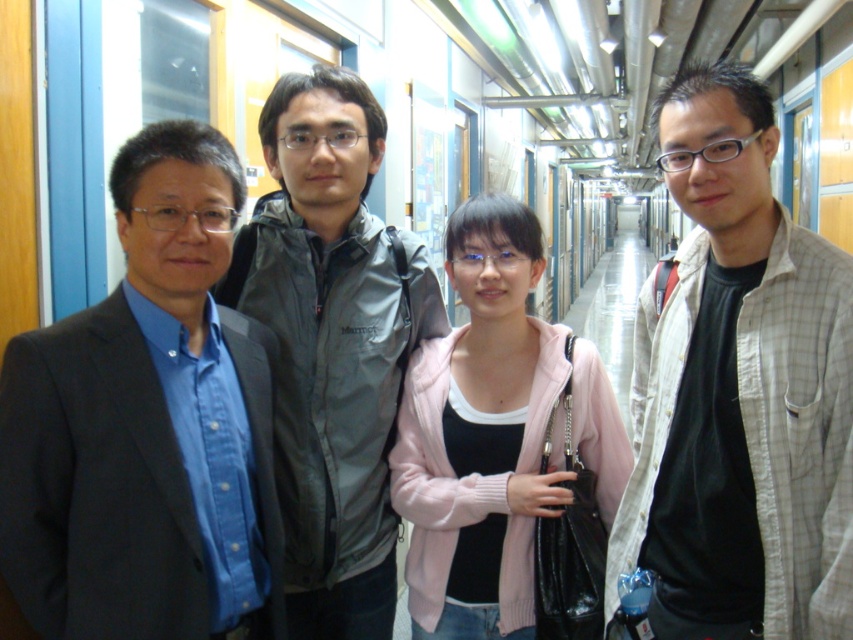
Is white checkered shirt at right above gray matte jacket at center?

Correct, white checkered shirt at right is located above gray matte jacket at center.

Is white checkered shirt at right behind gray matte jacket at center?

No.

Image resolution: width=853 pixels, height=640 pixels. What do you see at coordinates (740, 392) in the screenshot?
I see `white checkered shirt at right` at bounding box center [740, 392].

Identify the location of white checkered shirt at right. point(740,392).

Is white checkered shirt at right thinner than pink knitted sweater at center?

Yes.

What do you see at coordinates (740, 392) in the screenshot?
I see `white checkered shirt at right` at bounding box center [740, 392].

Where is `white checkered shirt at right`? white checkered shirt at right is located at coordinates (740, 392).

Does gray matte jacket at center have a greater height compared to pink knitted sweater at center?

Correct, gray matte jacket at center is much taller as pink knitted sweater at center.

Measure the distance between gray matte jacket at center and pink knitted sweater at center.

gray matte jacket at center is 8.90 inches away from pink knitted sweater at center.

The image size is (853, 640). What do you see at coordinates (332, 346) in the screenshot?
I see `gray matte jacket at center` at bounding box center [332, 346].

Find the location of a particular element. The height and width of the screenshot is (640, 853). gray matte jacket at center is located at coordinates (332, 346).